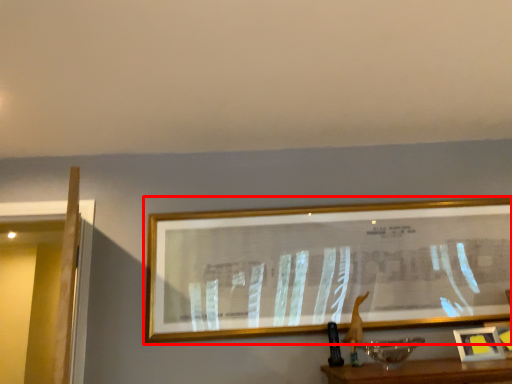
Question: From the image's perspective, considering the relative positions of picture frame (annotated by the red box) and picture frame in the image provided, where is picture frame (annotated by the red box) located with respect to the staircase?

Choices:
 (A) below
 (B) above

Answer: (B)